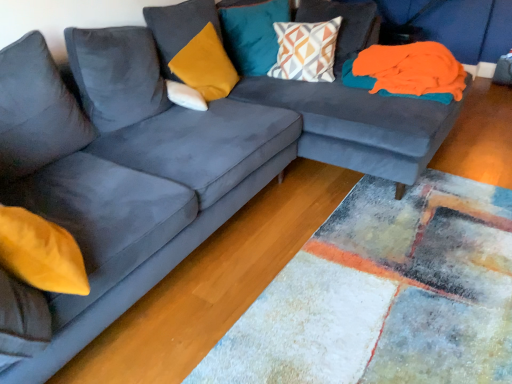
Question: Which direction should I rotate to look at velvet mustard pillow at upper center, marked as the 2th pillow in a left-to-right arrangement, — up or down?

Choices:
 (A) down
 (B) up

Answer: (B)

Question: Which direction should I rotate to look at geometric-patterned fabric pillow at upper center, arranged as the first pillow when viewed from the right?

Choices:
 (A) right
 (B) left

Answer: (A)

Question: Considering the relative positions of geometric-patterned fabric pillow at upper center, which is counted as the 4th pillow, starting from the left, and velvet mustard pillow at upper center, the 3th pillow from the right, in the image provided, is geometric-patterned fabric pillow at upper center, which is counted as the 4th pillow, starting from the left, behind velvet mustard pillow at upper center, the 3th pillow from the right,?

Choices:
 (A) no
 (B) yes

Answer: (B)

Question: Can you confirm if geometric-patterned fabric pillow at upper center, arranged as the first pillow when viewed from the right, is wider than velvet mustard pillow at upper center, marked as the 2th pillow in a left-to-right arrangement?

Choices:
 (A) yes
 (B) no

Answer: (B)

Question: Is geometric-patterned fabric pillow at upper center, which is counted as the 4th pillow, starting from the left, not near velvet mustard pillow at upper center, the 3th pillow from the right?

Choices:
 (A) no
 (B) yes

Answer: (A)

Question: Is geometric-patterned fabric pillow at upper center, arranged as the first pillow when viewed from the right, to the left of velvet mustard pillow at upper center, the 3th pillow from the right, from the viewer's perspective?

Choices:
 (A) yes
 (B) no

Answer: (B)

Question: Can you confirm if geometric-patterned fabric pillow at upper center, arranged as the first pillow when viewed from the right, is bigger than velvet mustard pillow at upper center, marked as the 2th pillow in a left-to-right arrangement?

Choices:
 (A) no
 (B) yes

Answer: (B)

Question: From the image's perspective, is geometric-patterned fabric pillow at upper center, which is counted as the 4th pillow, starting from the left, under velvet mustard pillow at upper center, the 3th pillow from the right?

Choices:
 (A) no
 (B) yes

Answer: (A)

Question: Is orange fabric at upper right positioned beyond the bounds of white soft pillow at center, the first pillow in the left-to-right sequence?

Choices:
 (A) yes
 (B) no

Answer: (A)

Question: Can you confirm if orange fabric at upper right is bigger than white soft pillow at center, arranged as the fourth pillow when viewed from the right?

Choices:
 (A) no
 (B) yes

Answer: (B)

Question: From a real-world perspective, is orange fabric at upper right on top of white soft pillow at center, arranged as the fourth pillow when viewed from the right?

Choices:
 (A) no
 (B) yes

Answer: (B)

Question: Can you confirm if orange fabric at upper right is thinner than white soft pillow at center, the first pillow in the left-to-right sequence?

Choices:
 (A) no
 (B) yes

Answer: (A)

Question: Does orange fabric at upper right turn towards white soft pillow at center, the first pillow in the left-to-right sequence?

Choices:
 (A) no
 (B) yes

Answer: (A)

Question: Considering the relative positions of orange fabric at upper right and white soft pillow at center, arranged as the fourth pillow when viewed from the right, in the image provided, is orange fabric at upper right behind white soft pillow at center, arranged as the fourth pillow when viewed from the right,?

Choices:
 (A) yes
 (B) no

Answer: (B)

Question: Considering the relative sizes of teal velvet cushion at upper center, acting as the second pillow starting from the right, and geometric-patterned fabric pillow at upper center, arranged as the first pillow when viewed from the right, in the image provided, is teal velvet cushion at upper center, acting as the second pillow starting from the right, taller than geometric-patterned fabric pillow at upper center, arranged as the first pillow when viewed from the right,?

Choices:
 (A) no
 (B) yes

Answer: (B)